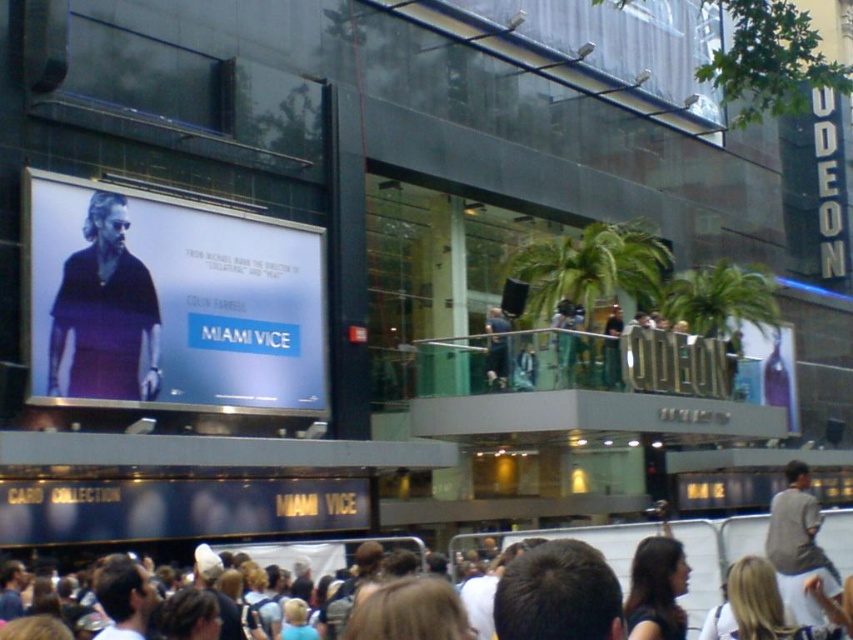
Does matte purple poster at upper left have a greater width compared to blue matte signboard at center?

Incorrect, matte purple poster at upper left's width does not surpass blue matte signboard at center's.

Between point (171, 246) and point (184, 515), which one is positioned behind?

Positioned behind is point (184, 515).

Does point (194, 317) lie in front of point (335, 506)?

Yes, it is.

The image size is (853, 640). What are the coordinates of `matte purple poster at upper left` in the screenshot? It's located at (170, 301).

Can you confirm if blue matte signboard at center is shorter than gray fabric jacket at lower right?

Yes, blue matte signboard at center is shorter than gray fabric jacket at lower right.

Can you confirm if blue matte signboard at center is taller than gray fabric jacket at lower right?

No.

Is point (317, 515) closer to camera compared to point (817, 604)?

No, it is not.

The width and height of the screenshot is (853, 640). In order to click on blue matte signboard at center in this screenshot , I will do `click(177, 509)`.

In the scene shown: Does matte purple poster at upper left have a larger size compared to brown hair at center?

Yes, matte purple poster at upper left is bigger than brown hair at center.

Is point (62, 230) behind point (517, 589)?

Yes.

Between point (294, 316) and point (593, 576), which one is positioned in front?

Point (593, 576) is in front.

Locate an element on the screen. The height and width of the screenshot is (640, 853). matte purple poster at upper left is located at coordinates (170, 301).